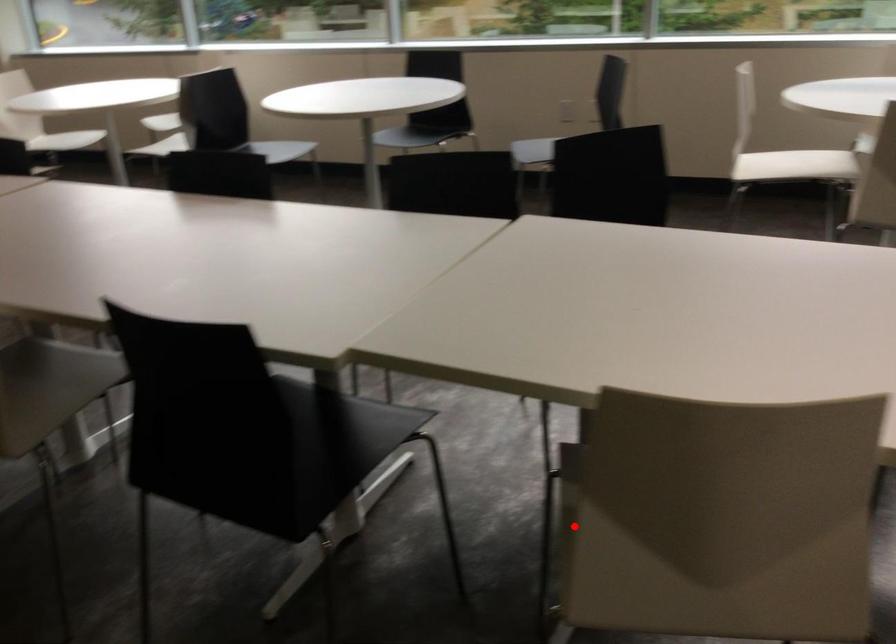
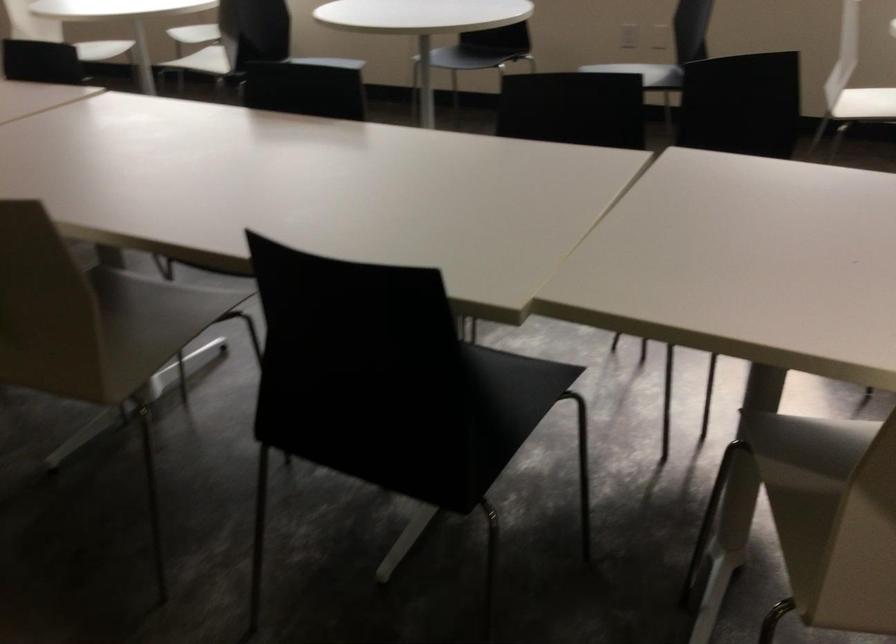
Question: I am providing you with two images of the same scene from different viewpoints. A red point is shown in image1. For the corresponding object point in image2, is it positioned nearer or farther from the camera?

Choices:
 (A) Nearer
 (B) Farther

Answer: (A)